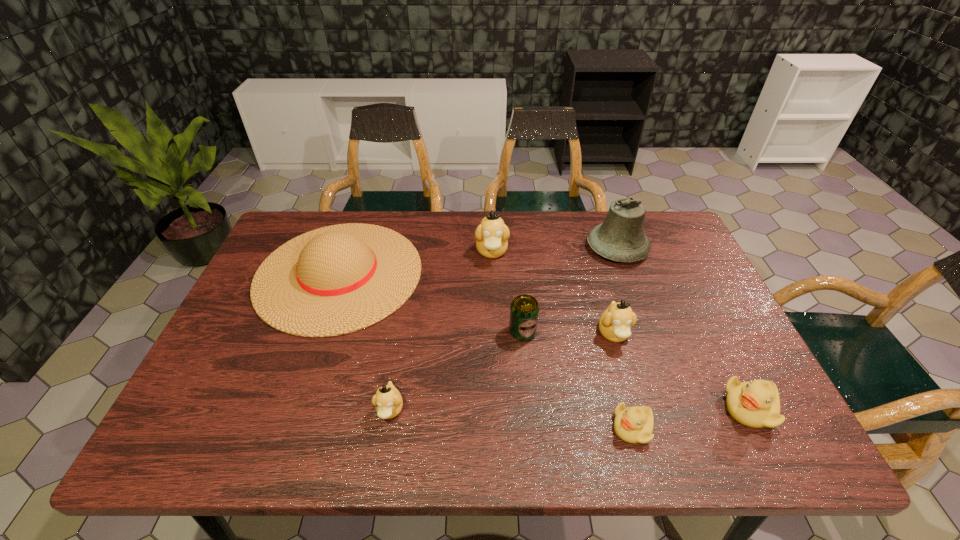
Find the location of `vacant area that lies between the rightmost duckling and the beige bonnet`. vacant area that lies between the rightmost duckling and the beige bonnet is located at coordinates (544, 341).

In order to click on vacant region between the rightmost object and the nearest tan duckling in this screenshot , I will do pyautogui.click(x=570, y=409).

You are a GUI agent. You are given a task and a screenshot of the screen. Output one action in this format:
    pyautogui.click(x=<x>, y=<y>)
    Task: Click on the free area in between the green beer can and the tallest duckling
    The width and height of the screenshot is (960, 540).
    Given the screenshot: What is the action you would take?
    pyautogui.click(x=507, y=292)

The height and width of the screenshot is (540, 960). Find the location of `vacant area that lies between the shortest duckling and the beer can`. vacant area that lies between the shortest duckling and the beer can is located at coordinates (578, 380).

The width and height of the screenshot is (960, 540). Find the location of `blank region between the bell and the beer can`. blank region between the bell and the beer can is located at coordinates (570, 290).

The image size is (960, 540). What are the coordinates of `free space between the leftmost tan duckling and the farthest tan duckling` in the screenshot? It's located at (441, 331).

The width and height of the screenshot is (960, 540). Find the location of `empty space that is in between the second tan duckling from left to right and the green beer can`. empty space that is in between the second tan duckling from left to right and the green beer can is located at coordinates (507, 292).

Identify which object is the sixth nearest to the bonnet. Please provide its 2D coordinates. Your answer should be formatted as a tuple, i.e. [(x, y)], where the tuple contains the x and y coordinates of a point satisfying the conditions above.

[(620, 238)]

Where is `the second closest object to the tallest duckling`? Image resolution: width=960 pixels, height=540 pixels. the second closest object to the tallest duckling is located at coordinates (524, 312).

Where is `duckling that can be found as the closest to the green beer can`? The height and width of the screenshot is (540, 960). duckling that can be found as the closest to the green beer can is located at coordinates (615, 323).